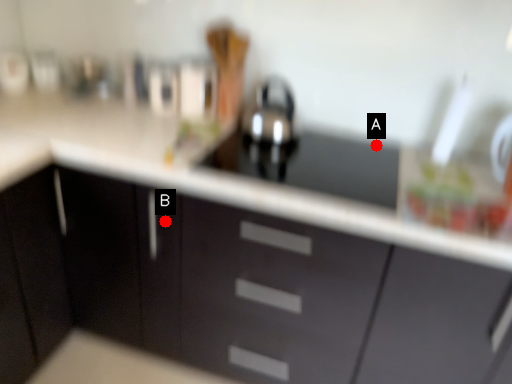
Question: Two points are circled on the image, labeled by A and B beside each circle. Which of the following is the farthest from the observer?

Choices:
 (A) A is further
 (B) B is further

Answer: (A)